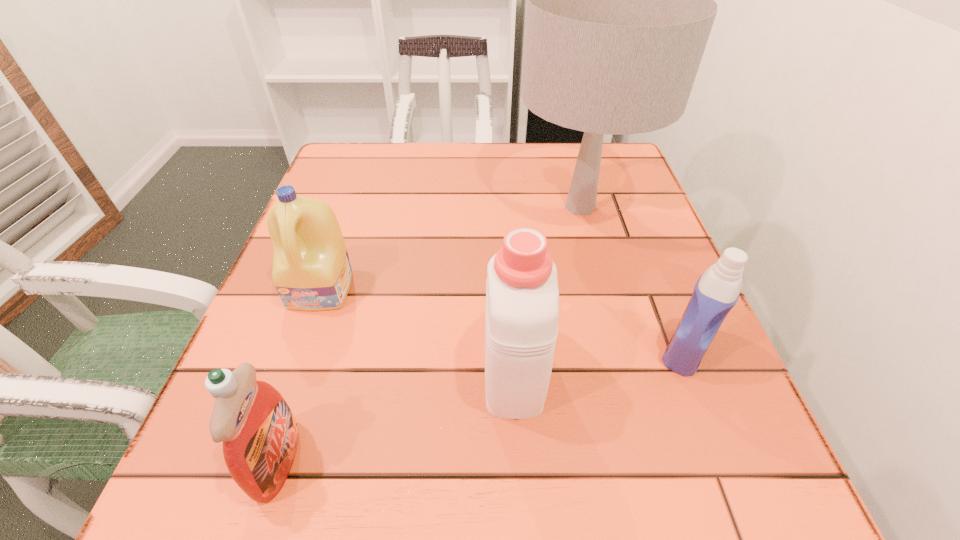
Locate an element on the screen. The image size is (960, 540). free space between the second detergent from right to left and the farthest detergent is located at coordinates (418, 328).

Identify the location of object that is the closest one to the farthest detergent. pos(259,432).

Identify which object is located as the nearest to the farthest detergent. Please provide its 2D coordinates. Your answer should be formatted as a tuple, i.e. [(x, y)], where the tuple contains the x and y coordinates of a point satisfying the conditions above.

[(259, 432)]

You are a GUI agent. You are given a task and a screenshot of the screen. Output one action in this format:
    pyautogui.click(x=<x>, y=<y>)
    Task: Click on the third closest detergent to the tallest detergent
    
    Given the screenshot: What is the action you would take?
    pyautogui.click(x=259, y=432)

Where is `detergent that stands as the closest to the farthest detergent`? This screenshot has height=540, width=960. detergent that stands as the closest to the farthest detergent is located at coordinates (259, 432).

You are a GUI agent. You are given a task and a screenshot of the screen. Output one action in this format:
    pyautogui.click(x=<x>, y=<y>)
    Task: Click on the free region that satisfies the following two spatial constraints: 1. on the front-facing side of the rightmost detergent; 2. on the left side of the tallest object
    
    Given the screenshot: What is the action you would take?
    pyautogui.click(x=618, y=351)

The width and height of the screenshot is (960, 540). Identify the location of free spot that satisfies the following two spatial constraints: 1. on the front-facing side of the tallest object; 2. on the back side of the rightmost detergent. (618, 351).

Locate an element on the screen. vacant space that satisfies the following two spatial constraints: 1. on the front-facing side of the rightmost detergent; 2. on the left side of the tallest object is located at coordinates (618, 351).

I want to click on vacant region that satisfies the following two spatial constraints: 1. on the front-facing side of the farthest object; 2. on the back side of the rightmost detergent, so click(x=618, y=351).